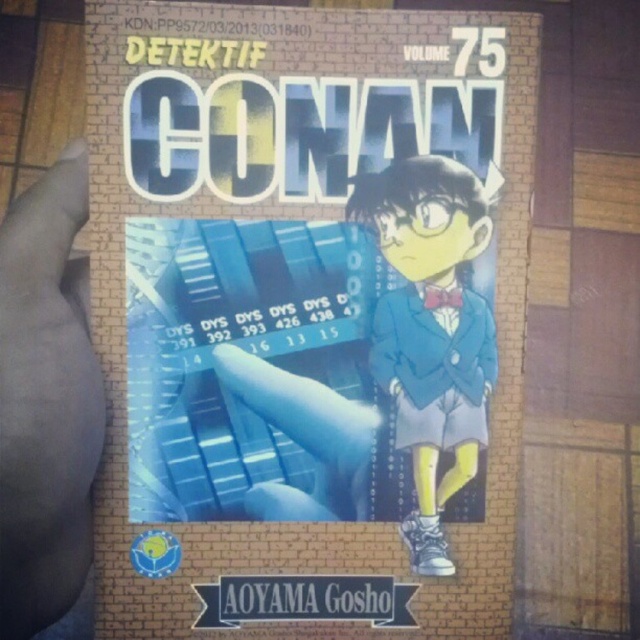
Which is behind, point (80, 260) or point (433, 368)?

Positioned behind is point (80, 260).

Does point (44, 246) lie in front of point (483, 336)?

That is True.

At what (x,y) coordinates should I click in order to perform the action: click on dark skin at left. Please return your answer as a coordinate pair (x, y). This screenshot has height=640, width=640. Looking at the image, I should click on click(x=45, y=401).

Does matte blue book at center have a greater height compared to dark skin at left?

Yes.

Is matte blue book at center to the left of dark skin at left from the viewer's perspective?

In fact, matte blue book at center is to the right of dark skin at left.

Where is `matte blue book at center`? matte blue book at center is located at coordinates pos(308,308).

Who is higher up, matte blue book at center or matte blue suit at center?

matte blue book at center

Does point (451, 620) come in front of point (433, 422)?

No, (451, 620) is further to viewer.

Where is `matte blue book at center`? This screenshot has height=640, width=640. matte blue book at center is located at coordinates pyautogui.click(x=308, y=308).